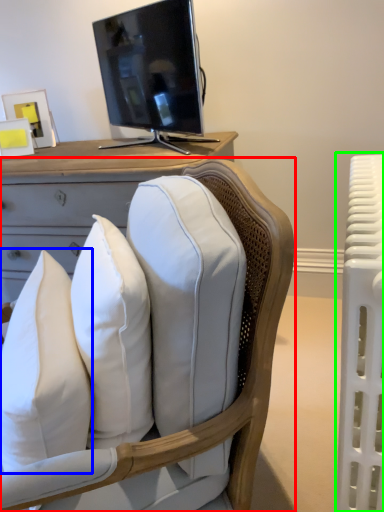
Question: Which object is the farthest from chair (highlighted by a red box)? Choose among these: pillow (highlighted by a blue box) or radiator (highlighted by a green box).

Choices:
 (A) pillow
 (B) radiator

Answer: (B)